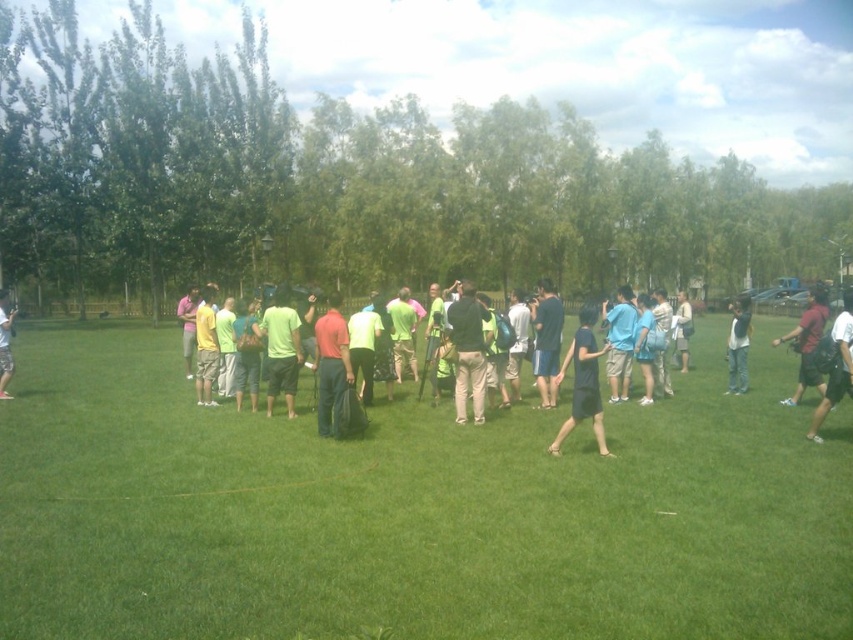
You are standing at the center of the grassy area and see the point marked at coordinates point (738, 346). What object is located at that point?

The point (738, 346) corresponds to jeans at right.

You are standing at the center of the grassy area and want to find the jeans at right. According to the coordinates provided, in which direction should you move to locate them?

The jeans at right is located at coordinates point [738,346]. Since you are at the center, moving towards the right side of the image will help you find the jeans at right.